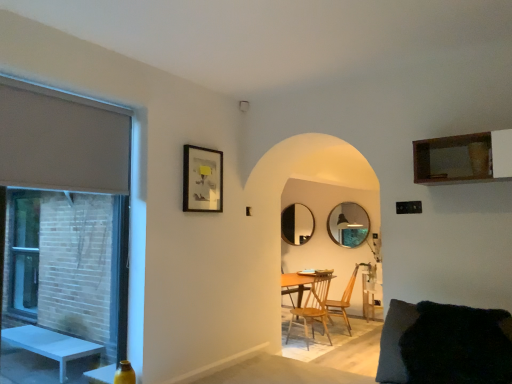
Question: Is matte black picture frame at upper left at the back of black glass mirror at center, which appears as the 2th mirror when viewed from the right?

Choices:
 (A) yes
 (B) no

Answer: (B)

Question: Is black glass mirror at center, which appears as the 2th mirror when viewed from the right, smaller than matte black picture frame at upper left?

Choices:
 (A) yes
 (B) no

Answer: (B)

Question: Is black glass mirror at center, positioned as the first mirror in back-to-front order, positioned behind matte black picture frame at upper left?

Choices:
 (A) yes
 (B) no

Answer: (A)

Question: From a real-world perspective, is black glass mirror at center, which appears as the 2th mirror when viewed from the right, physically below matte black picture frame at upper left?

Choices:
 (A) no
 (B) yes

Answer: (B)

Question: Could matte black picture frame at upper left be considered to be inside black glass mirror at center, positioned as the first mirror in back-to-front order?

Choices:
 (A) no
 (B) yes

Answer: (A)

Question: Do you think wooden at center, which is counted as the 2th chair, starting from the back, is within matte black picture frame at upper left, or outside of it?

Choices:
 (A) outside
 (B) inside

Answer: (A)

Question: Is wooden at center, which is counted as the 2th chair, starting from the back, in front of or behind matte black picture frame at upper left in the image?

Choices:
 (A) front
 (B) behind

Answer: (B)

Question: From their relative heights in the image, would you say wooden at center, positioned as the second chair in right-to-left order, is taller or shorter than matte black picture frame at upper left?

Choices:
 (A) tall
 (B) short

Answer: (A)

Question: Considering the relative positions of wooden at center, which ranks as the first chair in front-to-back order, and matte black picture frame at upper left in the image provided, is wooden at center, which ranks as the first chair in front-to-back order, to the left or to the right of matte black picture frame at upper left?

Choices:
 (A) left
 (B) right

Answer: (B)

Question: Choose the correct answer: Is wooden shelf at upper right inside black fuzzy pillow at lower right or outside it?

Choices:
 (A) outside
 (B) inside

Answer: (A)

Question: Is point (432, 152) closer or farther from the camera than point (391, 349)?

Choices:
 (A) closer
 (B) farther

Answer: (B)

Question: Is wooden shelf at upper right bigger or smaller than black fuzzy pillow at lower right?

Choices:
 (A) small
 (B) big

Answer: (A)

Question: Would you say wooden shelf at upper right is to the left or to the right of black fuzzy pillow at lower right in the picture?

Choices:
 (A) right
 (B) left

Answer: (A)

Question: Considering the positions of point (289, 238) and point (420, 140), is point (289, 238) closer or farther from the camera than point (420, 140)?

Choices:
 (A) closer
 (B) farther

Answer: (B)

Question: Is black glass mirror at center, the first mirror from the left, situated inside wooden shelf at upper right or outside?

Choices:
 (A) outside
 (B) inside

Answer: (A)